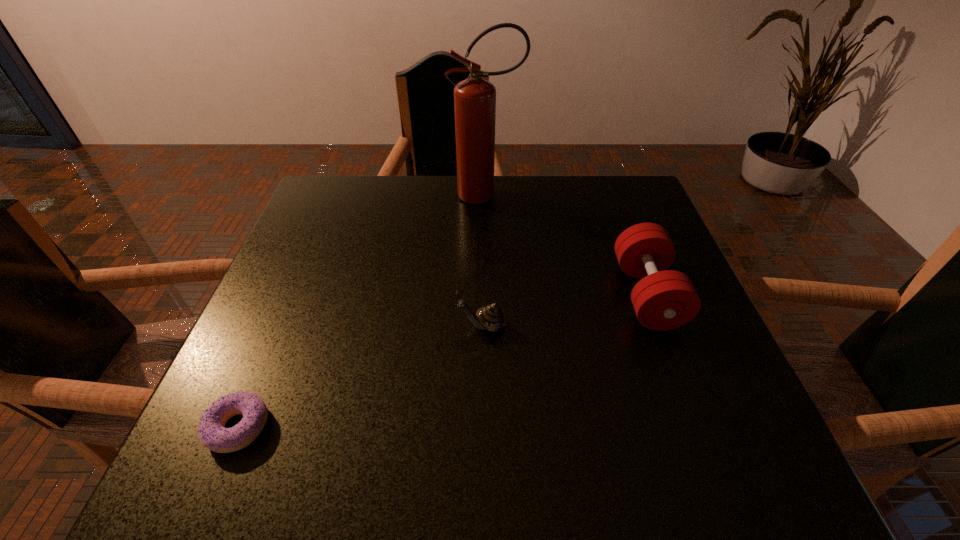
Where is `free space at the near edge of the desktop`? The width and height of the screenshot is (960, 540). free space at the near edge of the desktop is located at coordinates point(652,476).

This screenshot has width=960, height=540. Find the location of `vacant space at the left edge`. vacant space at the left edge is located at coordinates (324, 261).

Locate an element on the screen. free location at the right edge of the desktop is located at coordinates (674, 343).

I want to click on vacant space at the far left corner, so click(332, 206).

In the image, there is a desktop. At what (x,y) coordinates should I click in order to perform the action: click on vacant space at the near left corner. Please return your answer as a coordinate pair (x, y). Image resolution: width=960 pixels, height=540 pixels. Looking at the image, I should click on (232, 465).

This screenshot has width=960, height=540. I want to click on blank space at the far right corner of the desktop, so click(605, 222).

In the image, there is a desktop. Identify the location of free space at the near right corner. (680, 455).

Where is `vacant area that lies between the fire extinguisher and the rightmost object`? Image resolution: width=960 pixels, height=540 pixels. vacant area that lies between the fire extinguisher and the rightmost object is located at coordinates (566, 245).

Where is `free space between the rightmost object and the farthest object`? Image resolution: width=960 pixels, height=540 pixels. free space between the rightmost object and the farthest object is located at coordinates (566, 245).

Locate an element on the screen. free space that is in between the shortest object and the snail is located at coordinates (360, 376).